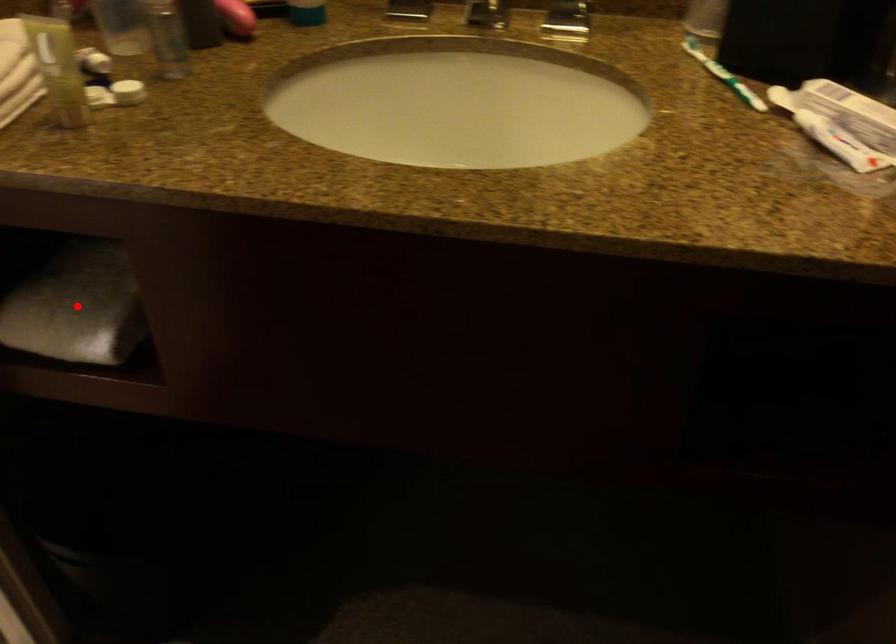
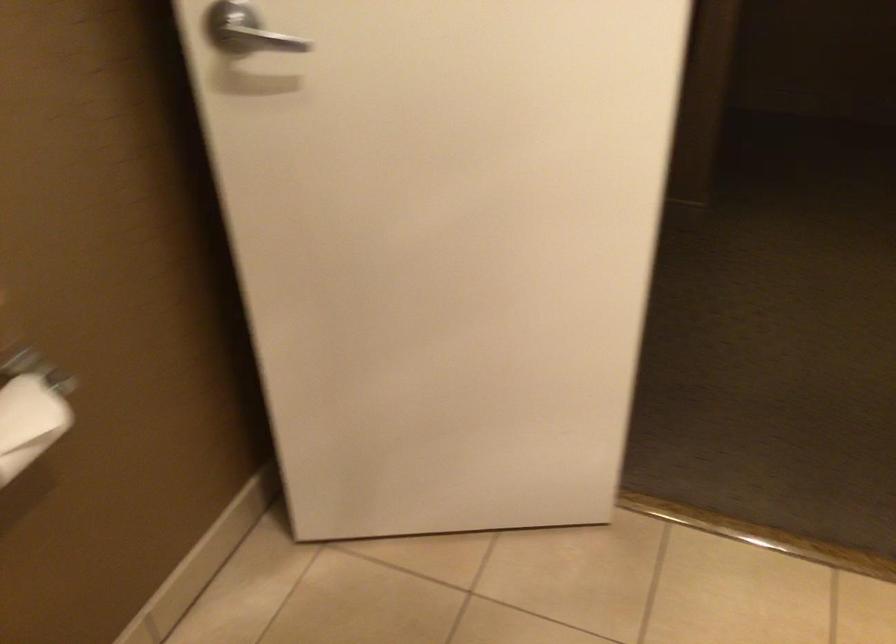
Question: I am providing you with two images of the same scene from different viewpoints. A red point is marked on the first image. At the location where the point appears in image 1, is it still visible in image 2?

Choices:
 (A) Yes
 (B) No

Answer: (B)